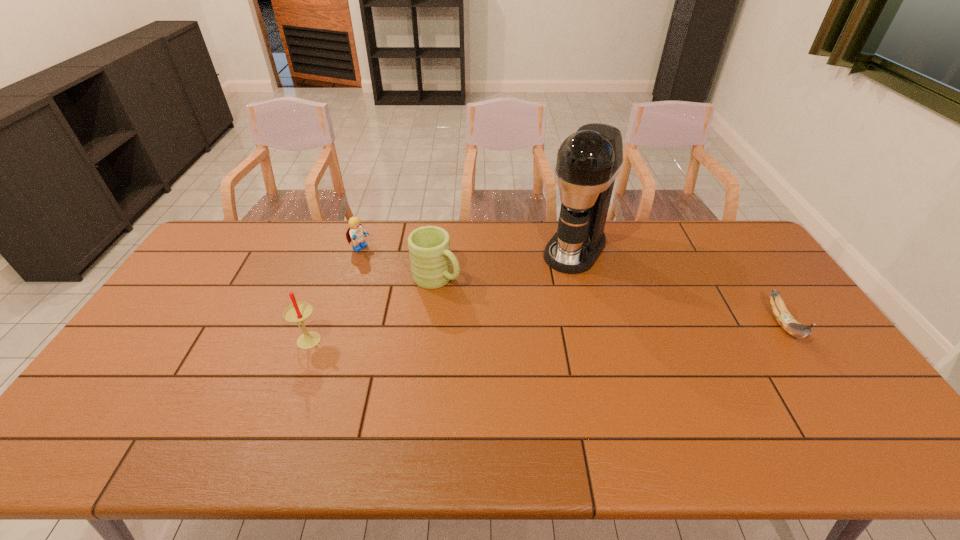
You are a GUI agent. You are given a task and a screenshot of the screen. Output one action in this format:
    pyautogui.click(x=<x>, y=<y>)
    Task: Click on the candle
    
    Given the screenshot: What is the action you would take?
    pyautogui.click(x=298, y=312)

Where is `banana`? banana is located at coordinates (785, 319).

Where is `the shortest object`? This screenshot has height=540, width=960. the shortest object is located at coordinates (785, 319).

Image resolution: width=960 pixels, height=540 pixels. Identify the location of the third object from left to right. point(429,246).

At what (x,y) coordinates should I click in order to perform the action: click on the third shortest object. Please return your answer as a coordinate pair (x, y). This screenshot has height=540, width=960. Looking at the image, I should click on pos(429,246).

Locate an element on the screen. the tallest object is located at coordinates (588, 161).

What are the coordinates of `coffee maker` in the screenshot? It's located at [588, 161].

Identify the location of Lego. point(356,234).

Identify the location of vacant space positioned on the left of the candle. (234, 340).

Where is `vacant region located on the peel of the rightmost object`? vacant region located on the peel of the rightmost object is located at coordinates (823, 383).